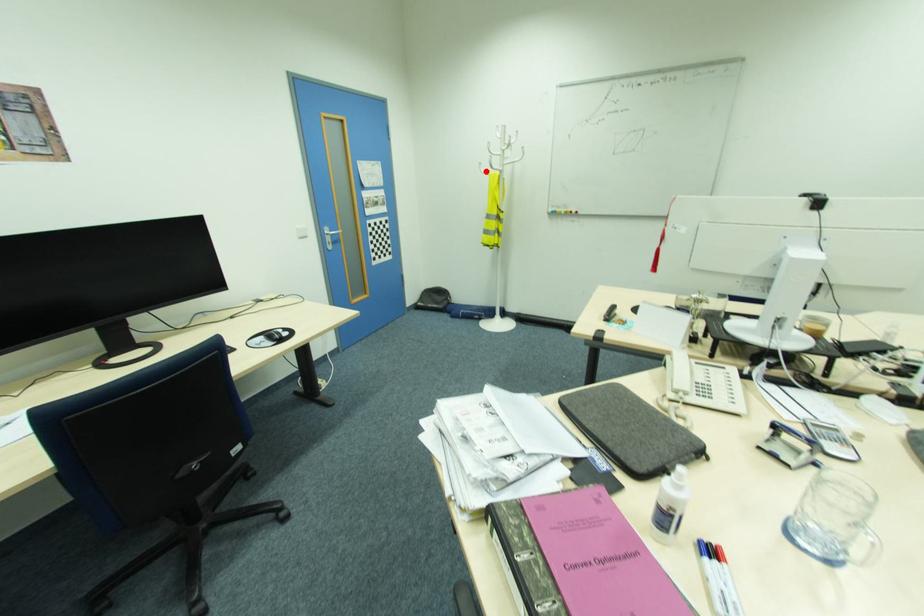
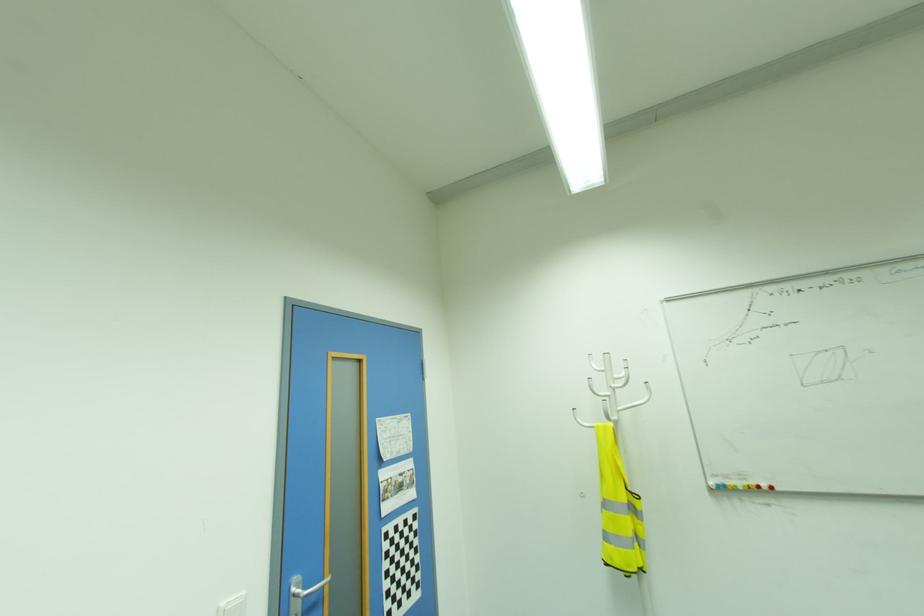
Question: I am providing you with two images of the same scene from different viewpoints. In image1, a red point is highlighted. Considering the same 3D point in image2, which of the following is correct?

Choices:
 (A) It is closer
 (B) It is farther

Answer: (B)